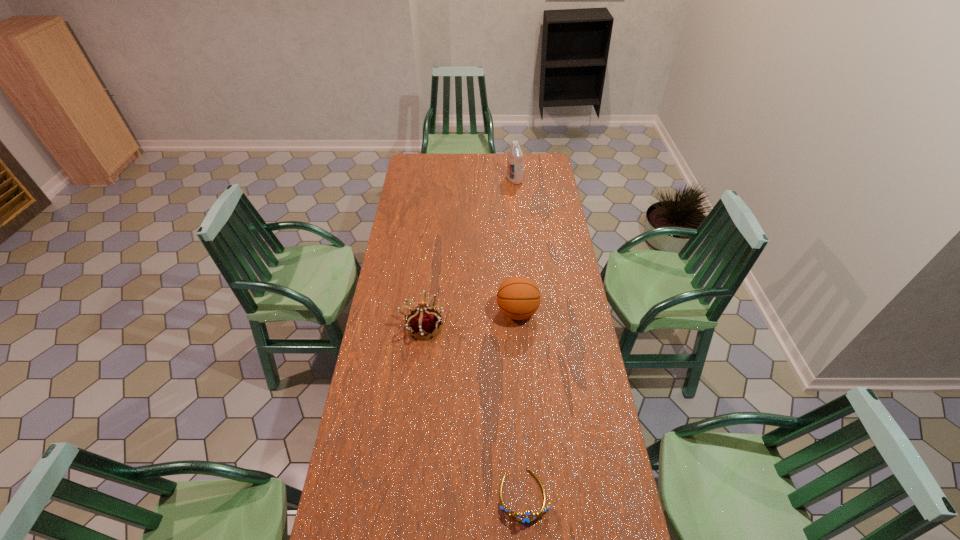
The height and width of the screenshot is (540, 960). In order to click on object present at the far edge in this screenshot , I will do `click(515, 155)`.

At what (x,y) coordinates should I click in order to perform the action: click on object situated at the left edge. Please return your answer as a coordinate pair (x, y). Looking at the image, I should click on (423, 320).

Locate an element on the screen. The width and height of the screenshot is (960, 540). blank space at the far edge is located at coordinates (526, 164).

At what (x,y) coordinates should I click in order to perform the action: click on free point at the left edge. Please return your answer as a coordinate pair (x, y). This screenshot has height=540, width=960. Looking at the image, I should click on (396, 336).

This screenshot has height=540, width=960. In order to click on vacant region at the right edge of the desktop in this screenshot , I will do `click(597, 435)`.

Locate an element on the screen. vacant region at the far right corner of the desktop is located at coordinates (554, 170).

The width and height of the screenshot is (960, 540). Find the location of `free spot between the farthest object and the farther tiara`. free spot between the farthest object and the farther tiara is located at coordinates (468, 253).

Identify the location of free space that is in between the leftmost object and the shorter tiara. The image size is (960, 540). (473, 411).

I want to click on vacant area that lies between the tallest object and the basketball, so click(516, 246).

You are a GUI agent. You are given a task and a screenshot of the screen. Output one action in this format:
    pyautogui.click(x=<x>, y=<y>)
    Task: Click on the empty location between the shortest object and the tallest object
    The width and height of the screenshot is (960, 540).
    Given the screenshot: What is the action you would take?
    pyautogui.click(x=519, y=338)